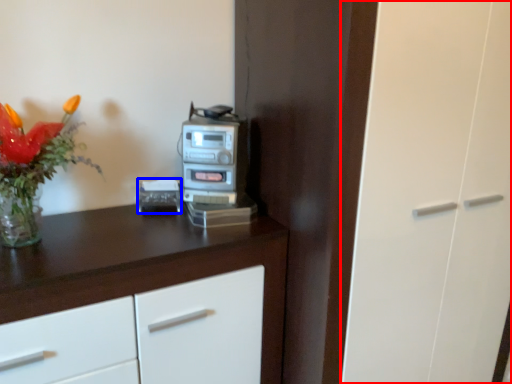
Question: Which object appears farthest to the camera in this image, glass door (highlighted by a red box) or appliance (highlighted by a blue box)?

Choices:
 (A) glass door
 (B) appliance

Answer: (B)